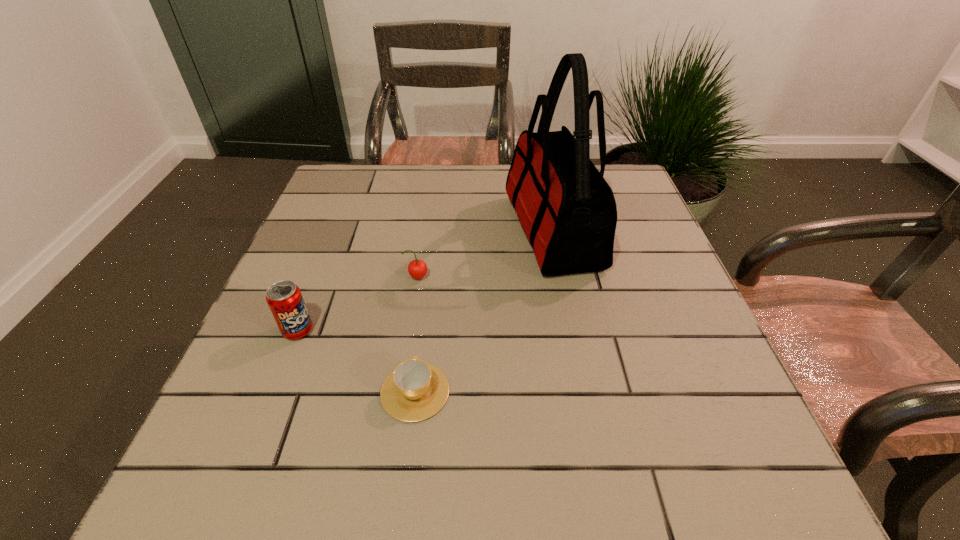
Locate an element on the screen. vacant point located between the third shortest object and the nearest object is located at coordinates (356, 361).

Find the location of a particular element. The height and width of the screenshot is (540, 960). empty space between the cherry and the nearest object is located at coordinates (417, 334).

Identify the location of the second closest object to the cherry. (x=284, y=298).

This screenshot has width=960, height=540. Find the location of `the third closest object relative to the second shortest object`. the third closest object relative to the second shortest object is located at coordinates (415, 390).

This screenshot has width=960, height=540. Find the location of `blank area in the image that satisfies the following two spatial constraints: 1. with the handle on the side of the nearest object; 2. on the left side of the rightmost object`. blank area in the image that satisfies the following two spatial constraints: 1. with the handle on the side of the nearest object; 2. on the left side of the rightmost object is located at coordinates (435, 231).

Locate an element on the screen. This screenshot has width=960, height=540. vacant region that satisfies the following two spatial constraints: 1. on the back side of the rightmost object; 2. on the right side of the second shortest object is located at coordinates (424, 231).

Identify the location of vacant space that satisfies the following two spatial constraints: 1. on the back side of the third tallest object; 2. on the right side of the tallest object. (424, 231).